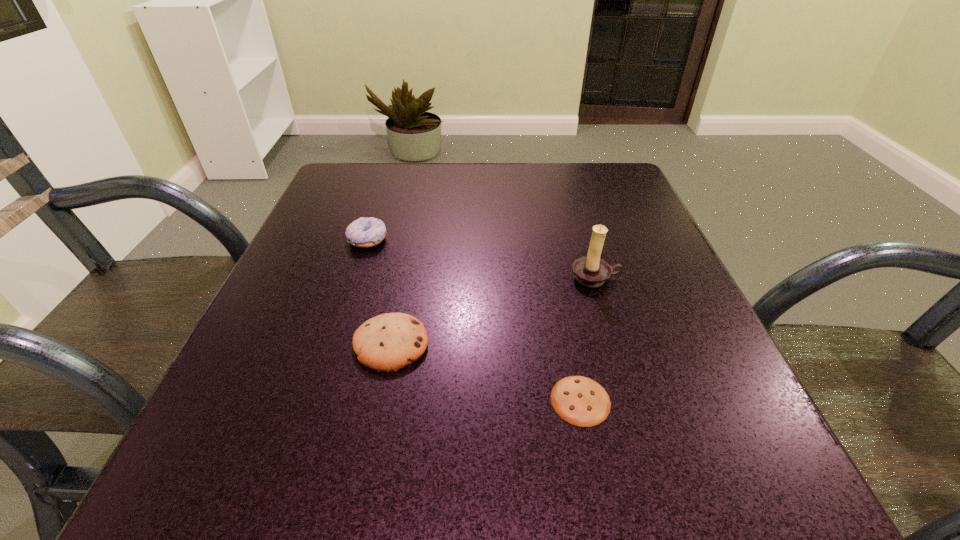
Point out which object is positioned as the second nearest to the candle holder. Please provide its 2D coordinates. Your answer should be formatted as a tuple, i.e. [(x, y)], where the tuple contains the x and y coordinates of a point satisfying the conditions above.

[(388, 342)]